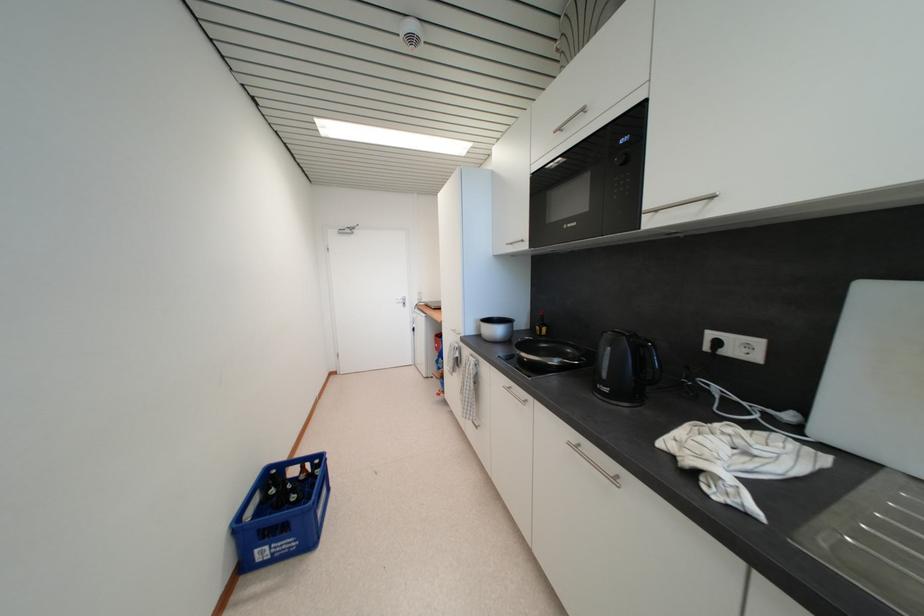
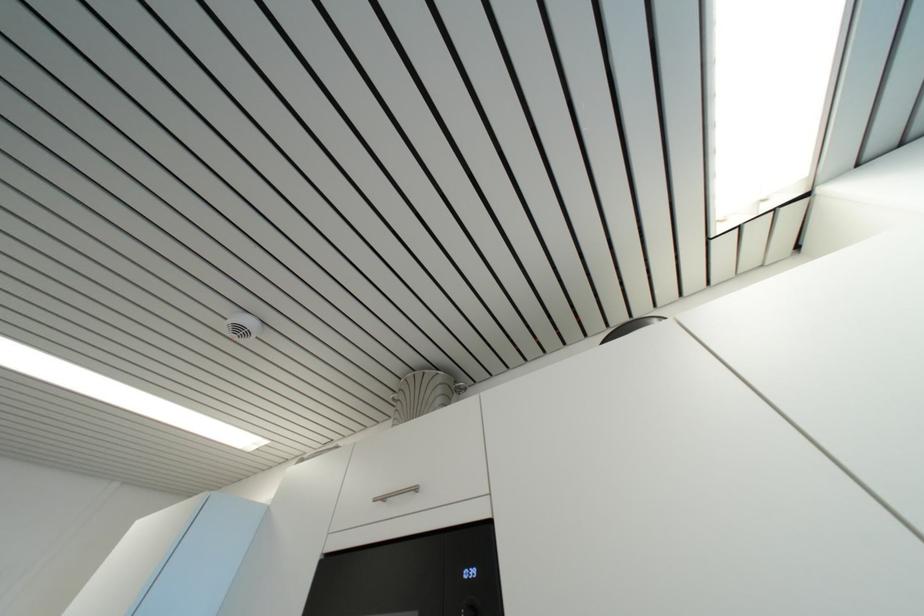
Based on the continuous images, in which direction is the camera rotating?

The rotation direction of the camera is right-up.